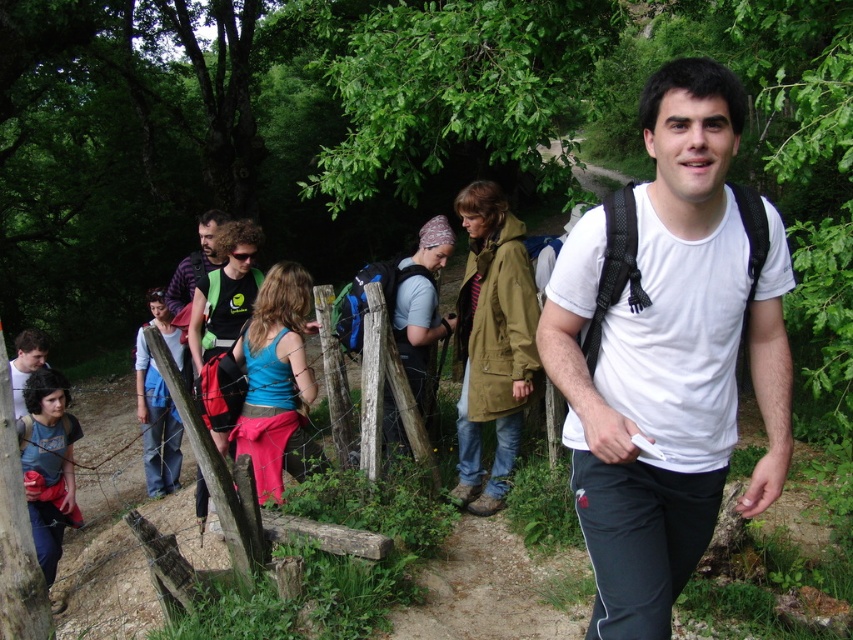
Question: Is matte gray shirt at center positioned at the back of denim skirt at center?

Choices:
 (A) yes
 (B) no

Answer: (B)

Question: In this image, where is matte blue shirt at lower left located relative to denim skirt at center?

Choices:
 (A) left
 (B) right

Answer: (A)

Question: Considering the real-world distances, which object is closest to the olive-green fabric jacket at center?

Choices:
 (A) blue fabric top at center
 (B) matte gray shirt at center
 (C) wooden fence at center
 (D) white matte t-shirt at center

Answer: (B)

Question: Which of the following is the farthest from the observer?

Choices:
 (A) (402, 355)
 (B) (134, 486)
 (C) (152, 380)
 (D) (50, 467)

Answer: (B)

Question: Does wooden fence at center have a smaller size compared to blue fabric top at center?

Choices:
 (A) no
 (B) yes

Answer: (A)

Question: Among these points, which one is nearest to the camera?

Choices:
 (A) (96, 573)
 (B) (386, 381)
 (C) (474, 500)

Answer: (B)